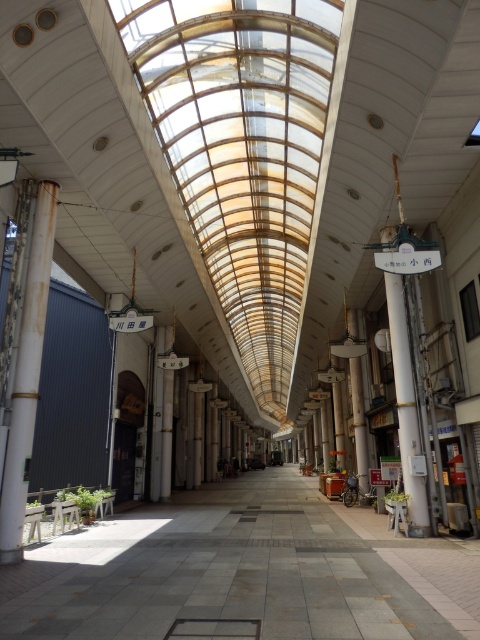
You are standing at the entrance of the shopping arcade and want to walk towards the gray concrete corridor at center. Is the rusty metal pole at left in your path?

The gray concrete corridor at center is closer to the viewer than the rusty metal pole at left, so the rusty metal pole at left is behind the corridor and not in your path.